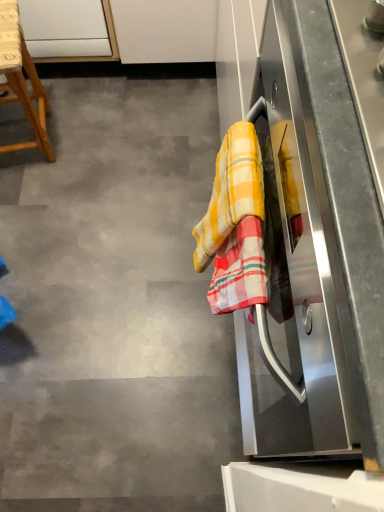
I want to click on free region under wooden stool at left (from a real-world perspective), so click(38, 150).